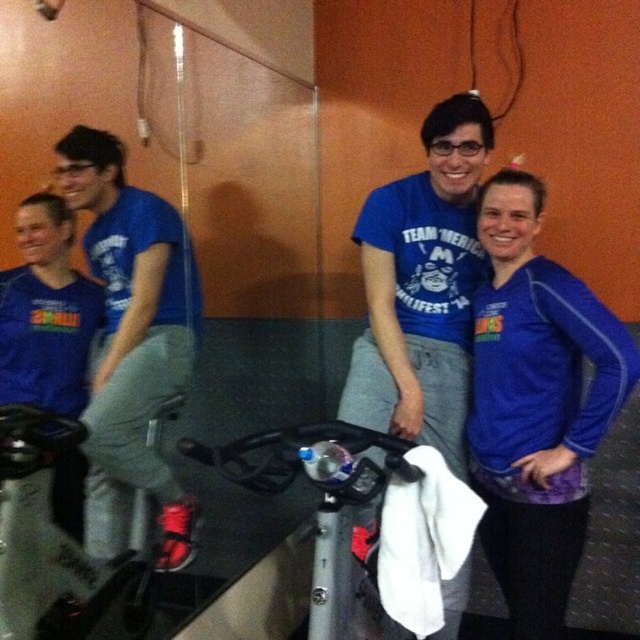
Question: Which of the following is the farthest from the observer?

Choices:
 (A) (28, 413)
 (B) (545, 317)

Answer: (A)

Question: Is blue t-shirt at left positioned before metallic silver bicycle at lower left?

Choices:
 (A) yes
 (B) no

Answer: (B)

Question: Does blue matte long-sleeve shirt at center-right have a smaller size compared to silver metallic bicycle at center?

Choices:
 (A) yes
 (B) no

Answer: (B)

Question: Which of the following is the closest to the observer?

Choices:
 (A) blue t-shirt at left
 (B) blue matte long-sleeve shirt at center-right
 (C) metallic silver bicycle at lower left

Answer: (B)

Question: Is metallic silver bicycle at lower left in front of silver metallic bicycle at center?

Choices:
 (A) no
 (B) yes

Answer: (A)

Question: Which object appears farthest from the camera in this image?

Choices:
 (A) metallic silver bicycle at lower left
 (B) silver metallic bicycle at center

Answer: (A)